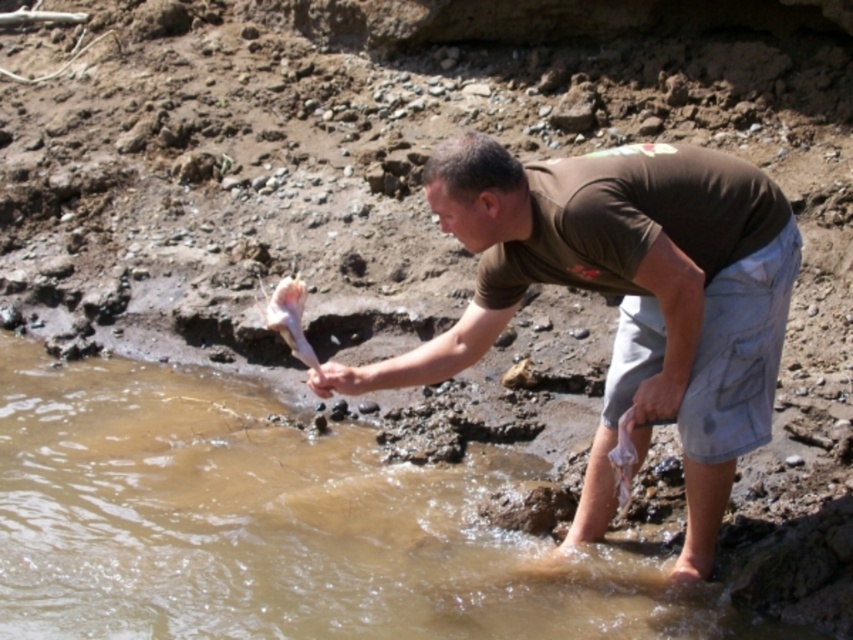
What is located at the coordinates point (625, 300)?

The brown cotton shirt at center is located at point (625, 300).

You are a safety inspector observing a man working near a riverbank. You need to ensure he maintains a safe distance from the edge to prevent slipping into the water. The safety guideline requires a minimum distance of 3 meters from the riverbank edge. Can you confirm if the man in the brown cotton shirt at center is complying with this safety regulation?

The man in the brown cotton shirt at center is 4.50 meters away from the edge, which exceeds the required 3 meters safety distance. Therefore, he is complying with the safety regulation.

You are a photographer trying to capture the man and the fish in the scene. Since the brown cotton shirt at center is positioned under the pink flesh at lower left, where should you focus your camera to ensure both the shirt and the pink flesh are in the frame?

To ensure both the brown cotton shirt at center and the pink flesh at lower left are in the frame, focus your camera on the area where the brown cotton shirt at center is positioned under the pink flesh at lower left.